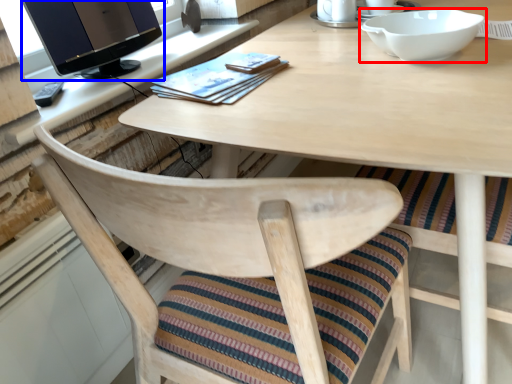
Question: Which point is further to the camera, bowl (highlighted by a red box) or computer monitor (highlighted by a blue box)?

Choices:
 (A) bowl
 (B) computer monitor

Answer: (B)